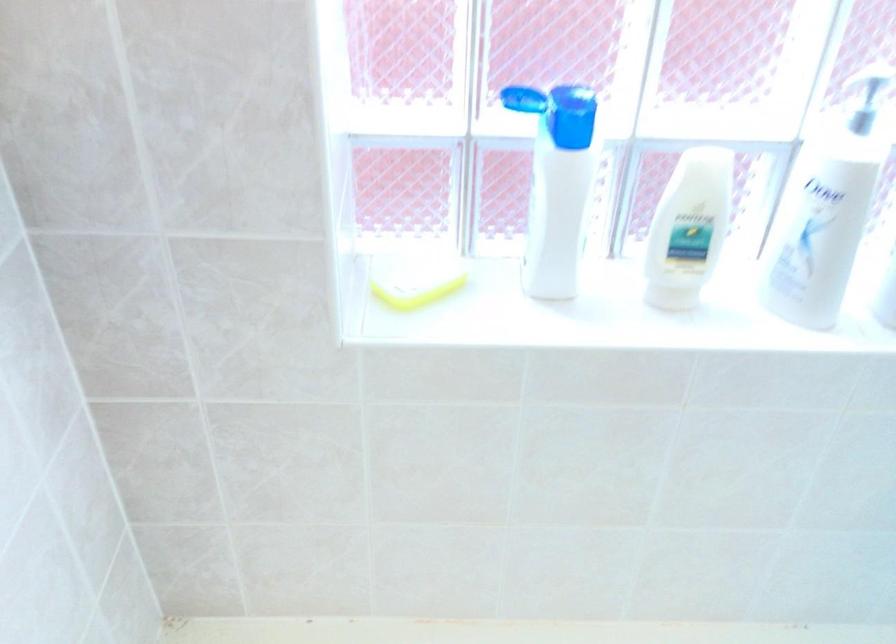
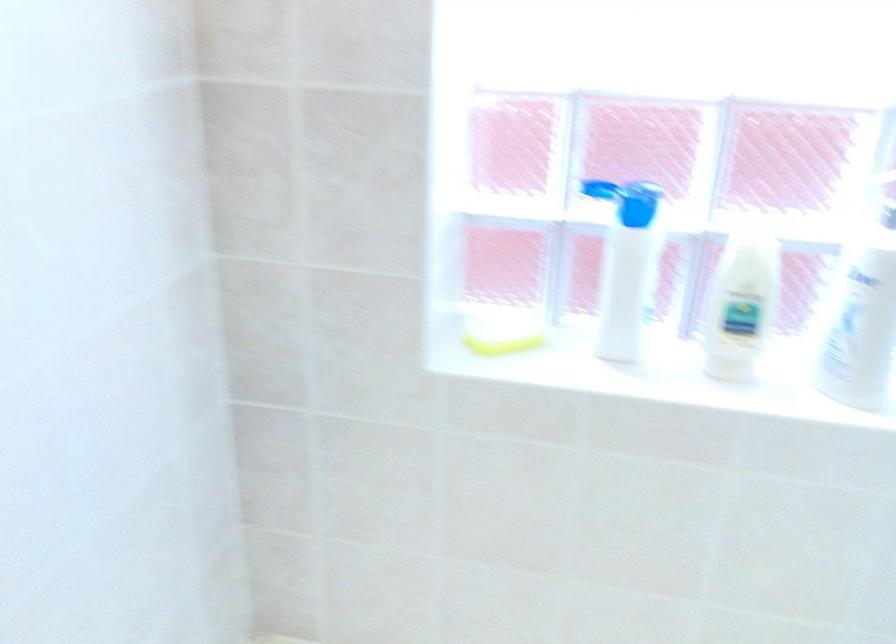
Where in the second image is the point corresponding to (563,199) from the first image?

(625, 266)